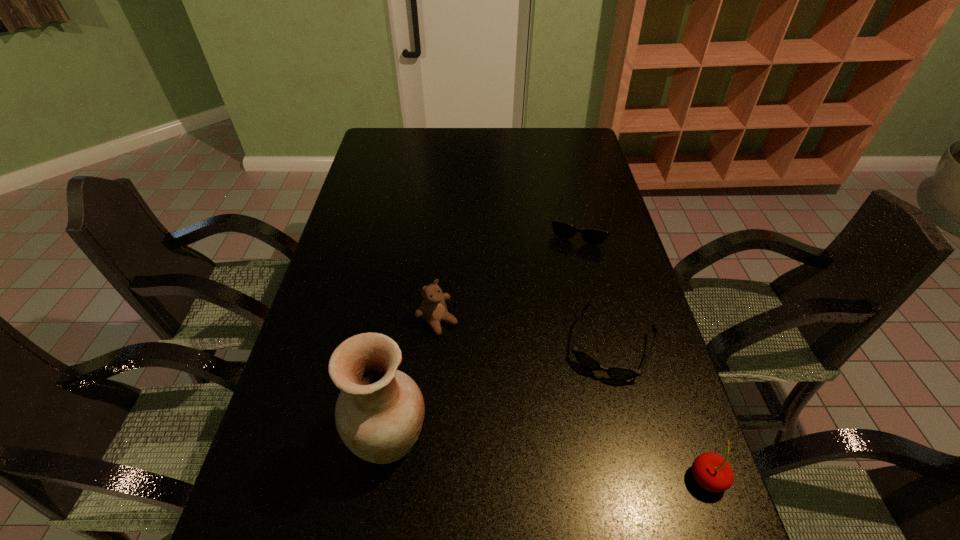
In the image, there is a desktop. Where is `free space at the far edge`? Image resolution: width=960 pixels, height=540 pixels. free space at the far edge is located at coordinates tap(433, 142).

Find the location of a particular element. vacant space at the near edge of the desktop is located at coordinates (475, 498).

Find the location of a particular element. Image resolution: width=960 pixels, height=540 pixels. vacant space at the left edge of the desktop is located at coordinates (302, 348).

You are a GUI agent. You are given a task and a screenshot of the screen. Output one action in this format:
    pyautogui.click(x=<x>, y=<y>)
    Task: Click on the vacant position at the right edge of the desktop
    The image size is (960, 540).
    Given the screenshot: What is the action you would take?
    coord(615,222)

This screenshot has width=960, height=540. Find the location of `free space at the far left corner`. free space at the far left corner is located at coordinates (390, 150).

Identify the location of vacant region at the far right corner of the desktop. The height and width of the screenshot is (540, 960). (571, 132).

What are the coordinates of `free spot between the nearer sunglasses and the pottery` in the screenshot? It's located at (500, 391).

Find the location of `free spot between the teddy bear and the cherry`. free spot between the teddy bear and the cherry is located at coordinates (572, 400).

Identify the location of empty space between the tallest object and the farthest object. (487, 330).

Locate an element on the screen. The width and height of the screenshot is (960, 540). free space between the farther sunglasses and the pottery is located at coordinates (487, 330).